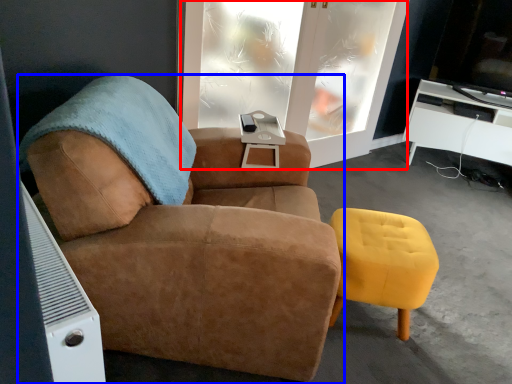
Question: Which of the following is the farthest to the observer, screen door (highlighted by a red box) or chair (highlighted by a blue box)?

Choices:
 (A) screen door
 (B) chair

Answer: (A)